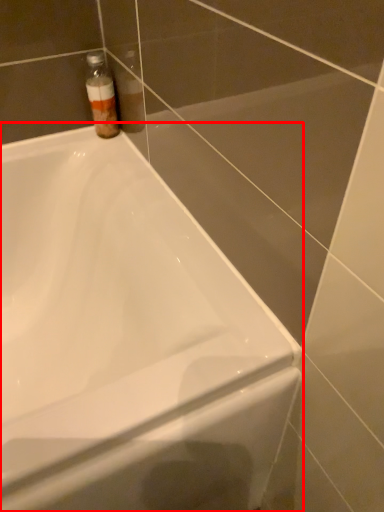
Question: From the image's perspective, where is bathtub (annotated by the red box) located relative to bottle?

Choices:
 (A) above
 (B) below

Answer: (B)